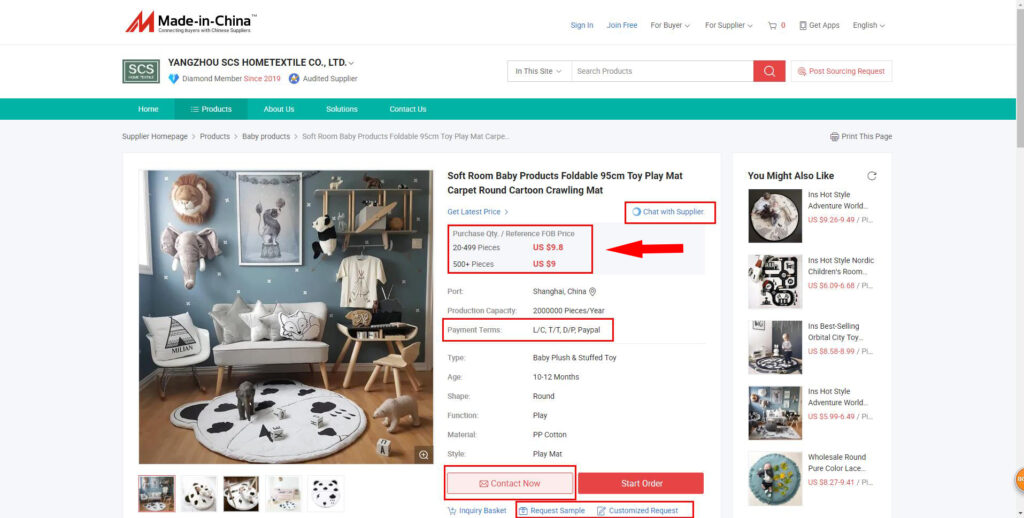
The width and height of the screenshot is (1024, 518). Identify the location of mounted toy lion head. (191, 192).